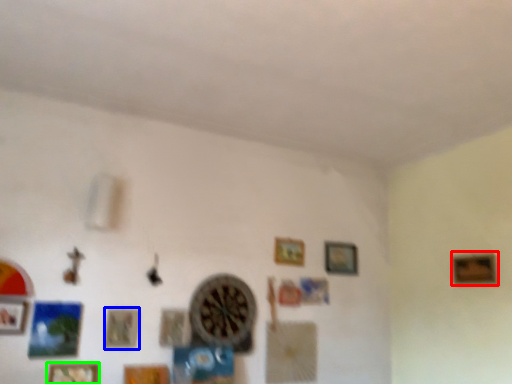
Question: Which object is the closest to the picture frame (highlighted by a red box)? Choose among these: picture frame (highlighted by a blue box) or picture frame (highlighted by a green box).

Choices:
 (A) picture frame
 (B) picture frame

Answer: (A)